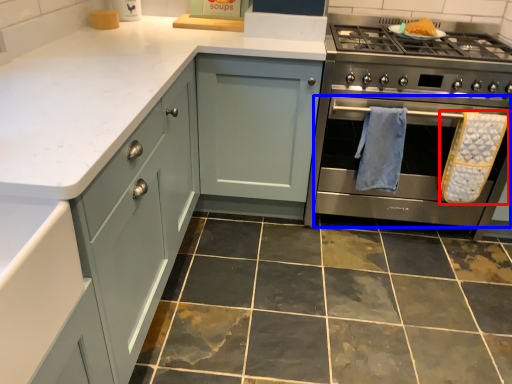
Question: Which object is closer to the camera taking this photo, bath towel (highlighted by a red box) or oven (highlighted by a blue box)?

Choices:
 (A) bath towel
 (B) oven

Answer: (B)